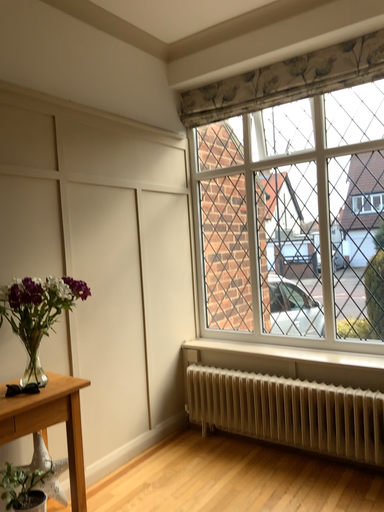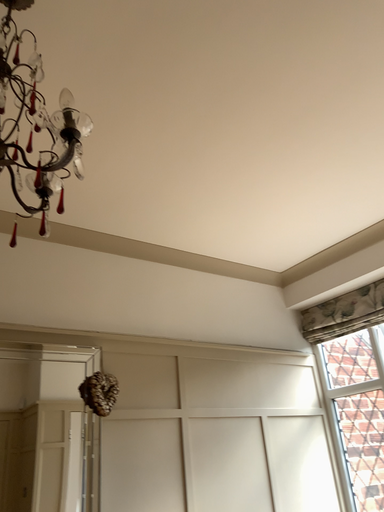
Question: Which way did the camera rotate in the video?

Choices:
 (A) rotated right
 (B) rotated left

Answer: (B)